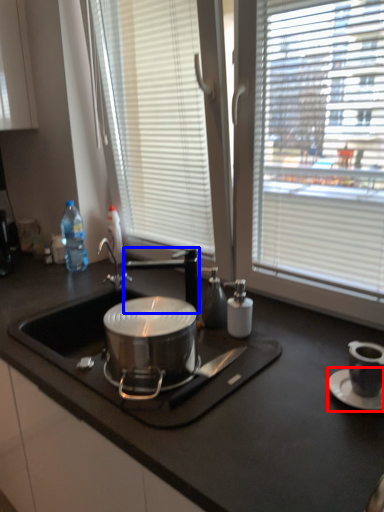
Question: Which of the following is the farthest to the observer, saucer (highlighted by a red box) or tap (highlighted by a blue box)?

Choices:
 (A) saucer
 (B) tap

Answer: (B)